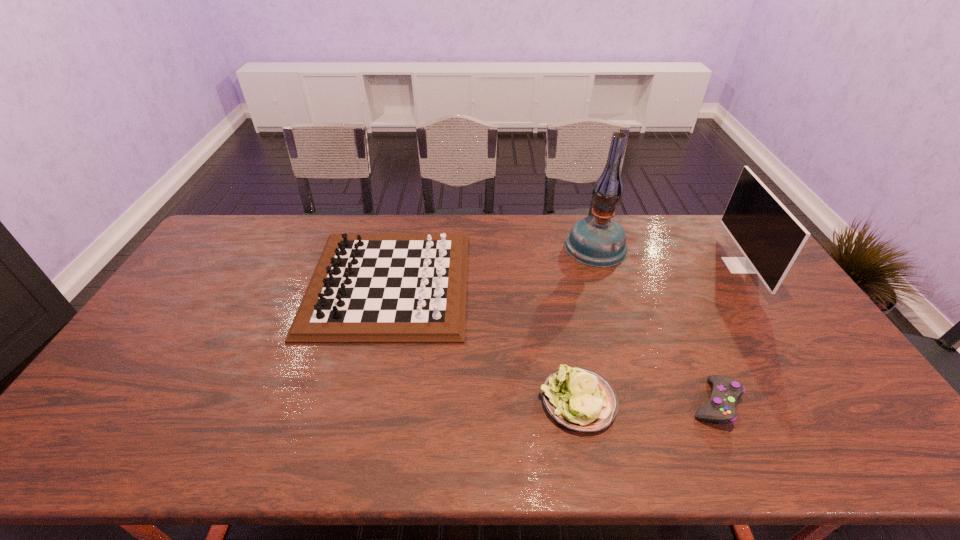
Where is `free point located 0.300m on the front-facing side of the fourth shortest object`? This screenshot has width=960, height=540. free point located 0.300m on the front-facing side of the fourth shortest object is located at coordinates (637, 266).

Locate an element on the screen. The height and width of the screenshot is (540, 960). vacant region located on the left of the leftmost object is located at coordinates (249, 283).

I want to click on free region located 0.110m on the left of the lettuce, so click(x=496, y=401).

At what (x,y) coordinates should I click in order to perform the action: click on vacant space located 0.060m on the front of the control. Please return your answer as a coordinate pair (x, y). Looking at the image, I should click on (738, 455).

Find the location of `oil lamp that is at the far edge`. oil lamp that is at the far edge is located at coordinates (598, 241).

You are a GUI agent. You are given a task and a screenshot of the screen. Output one action in this format:
    pyautogui.click(x=<x>, y=<y>)
    Task: Click on the monitor located in the far edge section of the desktop
    The height and width of the screenshot is (540, 960).
    Given the screenshot: What is the action you would take?
    pyautogui.click(x=769, y=236)

Find the location of a particular element. gameboard located in the far edge section of the desktop is located at coordinates (368, 288).

Find the location of `lettuce at the near edge`. lettuce at the near edge is located at coordinates (578, 398).

Identify the location of control that is at the near edge. (726, 391).

Locate an element on the screen. This screenshot has height=540, width=960. object present at the right edge is located at coordinates (769, 236).